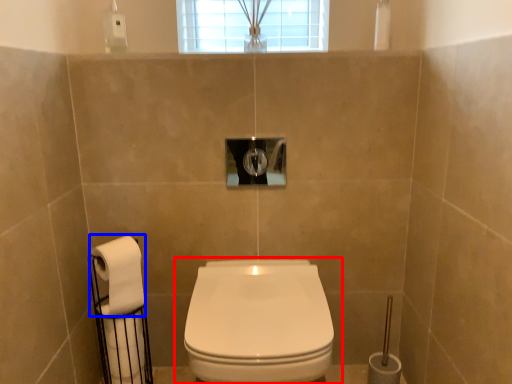
Question: Which of the following is the closest to the observer, toilet (highlighted by a red box) or toilet paper (highlighted by a blue box)?

Choices:
 (A) toilet
 (B) toilet paper

Answer: (A)